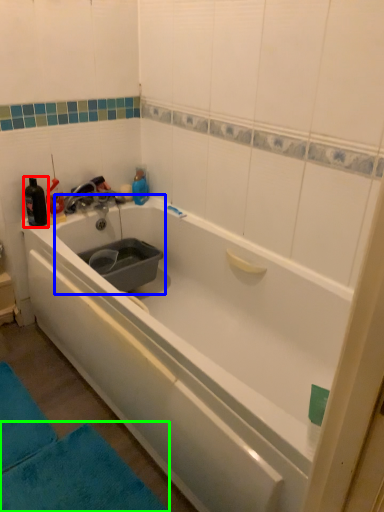
Question: Which object is positioned farthest from bottle (highlighted by a red box)? Select from sink (highlighted by a blue box) and bath mat (highlighted by a green box).

Choices:
 (A) sink
 (B) bath mat

Answer: (B)